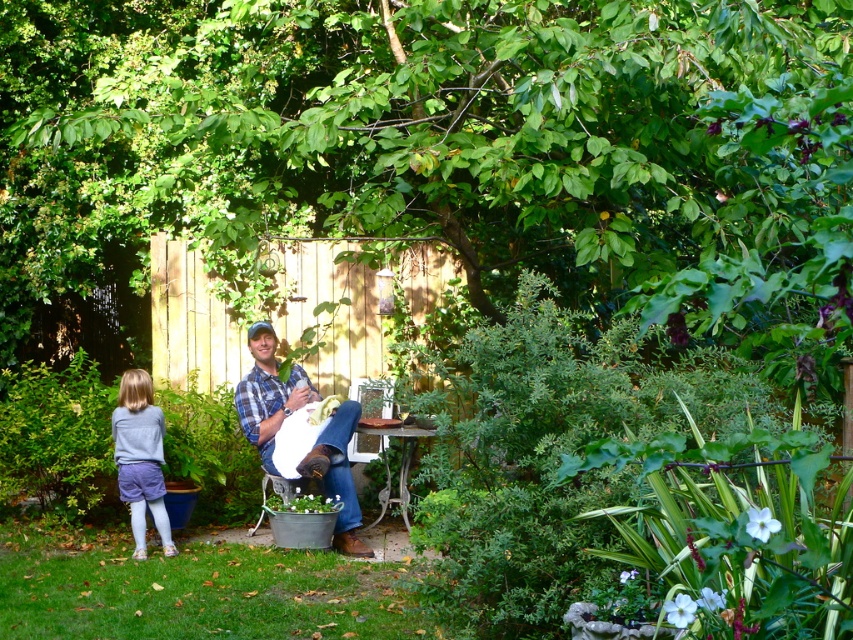
You are standing in the garden and want to place a small potted plant between the plaid shirt at center and the metallic silver table at center. Which object should you place the plant closer to so it is visible from your current position?

You should place the potted plant closer to the plaid shirt at center because it is closer to you than the metallic silver table at center, making it more visible from your current position.

You are a photographer trying to capture both the plaid shirt at center and the light gray cotton sweater at lower left in a single shot. Which object should you focus on first to ensure both are in the frame?

You should focus on the plaid shirt at center first because it is closer to you than the light gray cotton sweater at lower left, ensuring both are in the frame.

You are trying to decide which item to use to block a small hole in the ground. The light gray cotton sweater at lower left and the metallic silver table at center are available. Which item would be more effective at blocking the hole?

The metallic silver table at center is more effective at blocking the hole because it is thicker than the light gray cotton sweater at lower left.